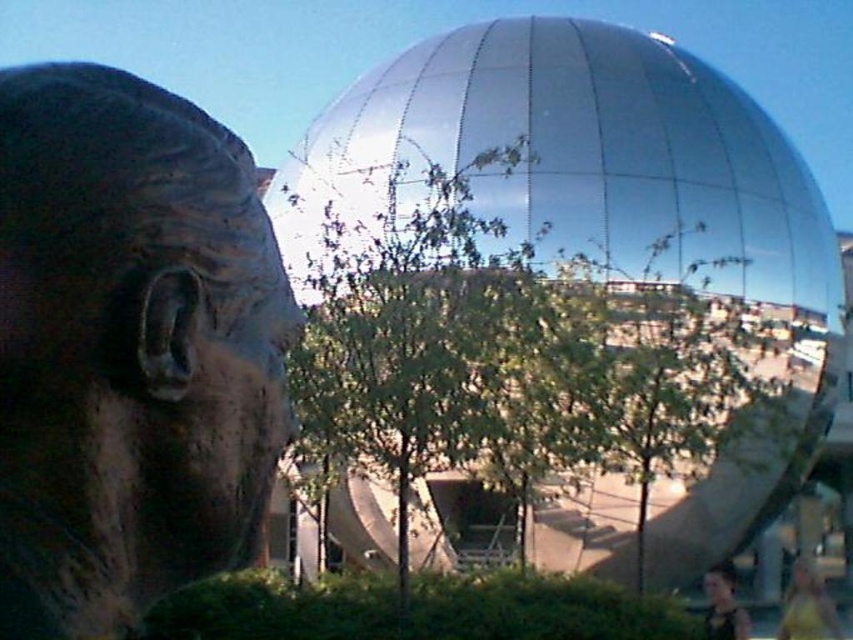
How much distance is there between brown stone statue at left and dark brown hair at lower right?

22.10 meters

Which is more to the right, brown stone statue at left or dark brown hair at lower right?

From the viewer's perspective, dark brown hair at lower right appears more on the right side.

Who is more distant from viewer, (231, 227) or (740, 636)?

Answer: The point (740, 636) is behind.

Identify the location of brown stone statue at left. This screenshot has height=640, width=853. (129, 348).

Does point (616, 364) come behind point (726, 563)?

That is False.

Is point (447, 257) in front of point (723, 584)?

Yes, it is in front of point (723, 584).

Who is more distant from viewer, (x=347, y=264) or (x=706, y=595)?

Positioned behind is point (x=706, y=595).

Where is `green leafy tree at center`? Image resolution: width=853 pixels, height=640 pixels. green leafy tree at center is located at coordinates (540, 372).

Does green leafy tree at center have a lesser width compared to yellow fabric shirt at lower right?

In fact, green leafy tree at center might be wider than yellow fabric shirt at lower right.

Is green leafy tree at center positioned before yellow fabric shirt at lower right?

Yes, it is in front of yellow fabric shirt at lower right.

Is point (439, 321) farther from viewer compared to point (827, 614)?

No, it is not.

You are a GUI agent. You are given a task and a screenshot of the screen. Output one action in this format:
    pyautogui.click(x=<x>, y=<y>)
    Task: Click on the green leafy tree at center
    
    Given the screenshot: What is the action you would take?
    pyautogui.click(x=540, y=372)